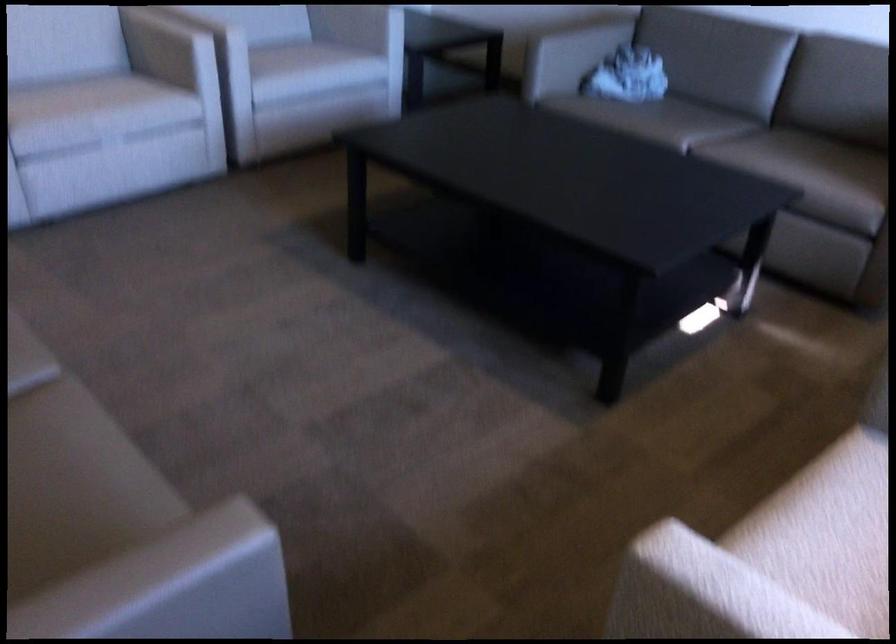
The height and width of the screenshot is (644, 896). Find the location of `sofa sitting surface`. sofa sitting surface is located at coordinates (714, 127).